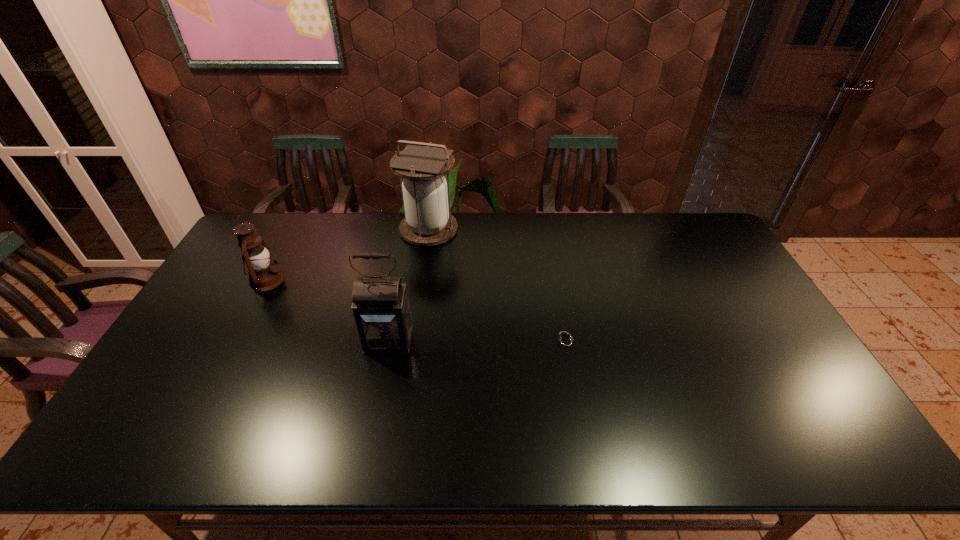
Locate an element on the screen. The image size is (960, 540). lantern that is the closest one to the nearest lantern is located at coordinates (263, 275).

Where is `lantern object that ranks as the second closest to the leftmost lantern`? The width and height of the screenshot is (960, 540). lantern object that ranks as the second closest to the leftmost lantern is located at coordinates (428, 222).